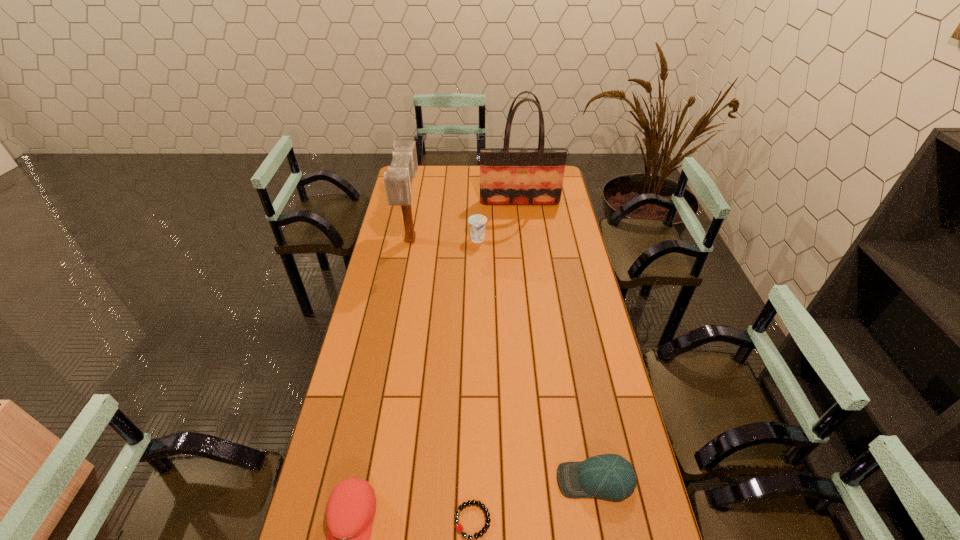
Find the location of a particular element. The image size is (960, 540). object that is the second nearest to the tallest object is located at coordinates (398, 180).

Identify which object is located as the fifth nearest to the baseball cap. Please provide its 2D coordinates. Your answer should be formatted as a tuple, i.e. [(x, y)], where the tuple contains the x and y coordinates of a point satisfying the conditions above.

[(508, 176)]

Locate an element on the screen. vacant region that satisfies the following two spatial constraints: 1. on the front side of the fourth shortest object; 2. on the left side of the baseball cap is located at coordinates (476, 480).